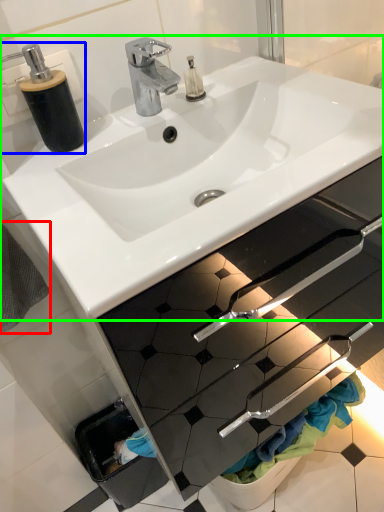
Question: Which object is positioned closest to bath towel (highlighted by a red box)? Select from soap dispenser (highlighted by a blue box) and sink (highlighted by a green box).

Choices:
 (A) soap dispenser
 (B) sink

Answer: (A)